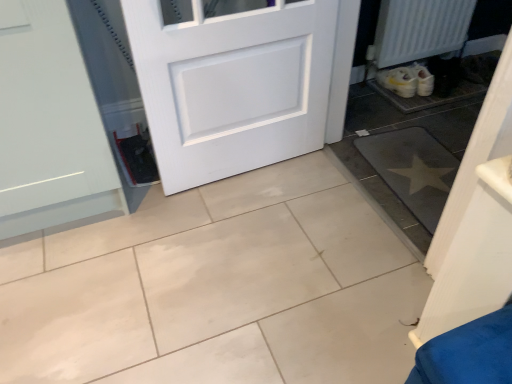
This screenshot has height=384, width=512. In order to click on unoccupied area in front of white matte door at center in this screenshot , I will do `click(252, 259)`.